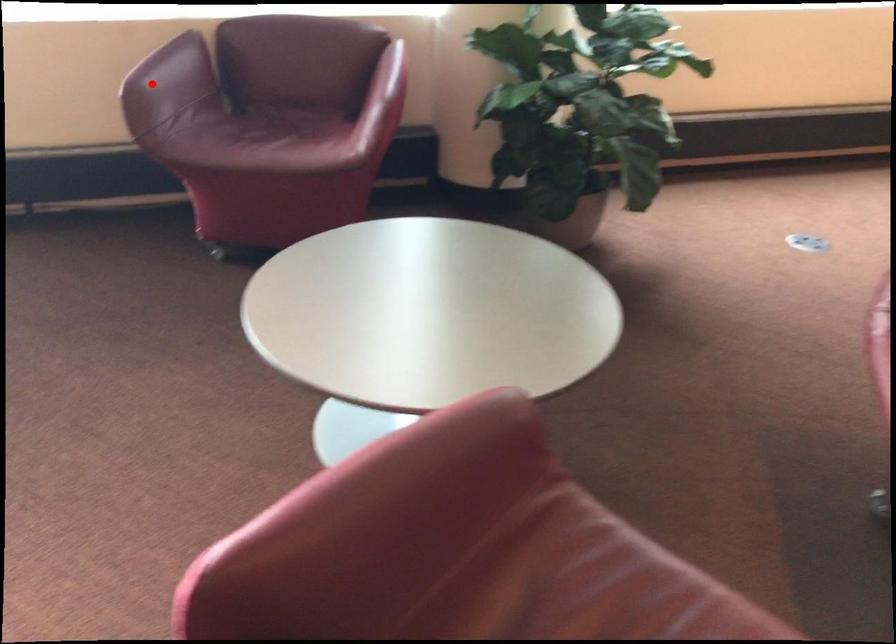
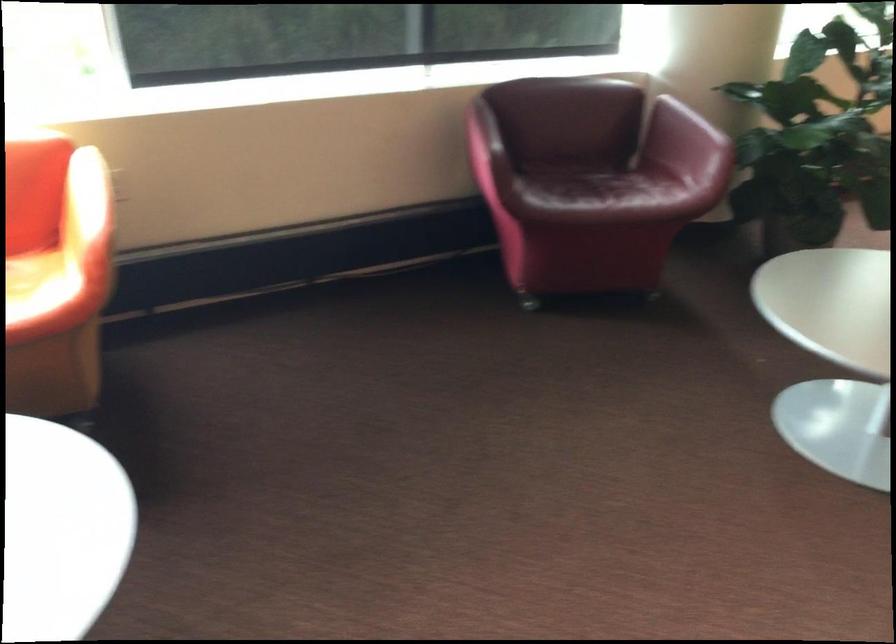
The point at the highlighted location is marked in the first image. Where is the corresponding point in the second image?

(483, 140)